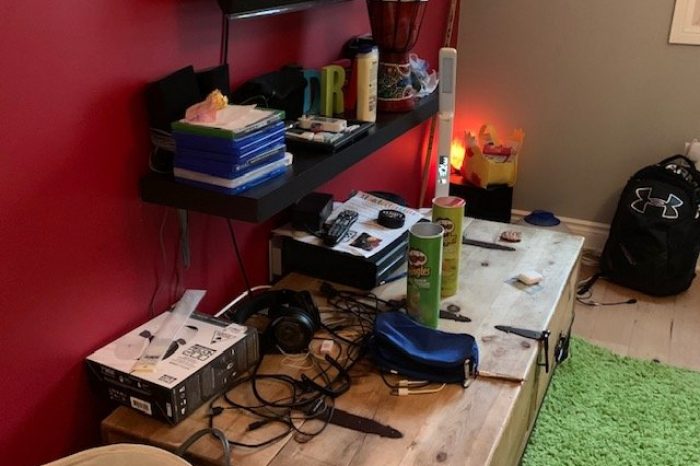
The height and width of the screenshot is (466, 700). In order to click on remote control in this screenshot , I will do `click(341, 225)`.